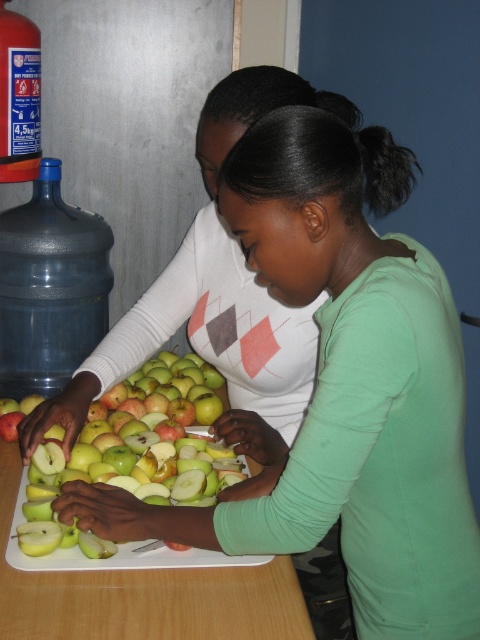
Which is more to the left, green matte apple at center or blue plastic bottle at left?

blue plastic bottle at left

Between point (204, 404) and point (17, 116), which one is positioned in front?

Positioned in front is point (204, 404).

Is point (123, 429) farther from viewer compared to point (31, 32)?

No, (123, 429) is closer to viewer.

At what (x,y) coordinates should I click in order to perform the action: click on green matte apple at center. Please return your answer as a coordinate pair (x, y). Looking at the image, I should click on (145, 456).

The height and width of the screenshot is (640, 480). Describe the element at coordinates (49, 288) in the screenshot. I see `black plastic bottle at left` at that location.

Can you confirm if black plastic bottle at left is smaller than green matte apple at center?

Correct, black plastic bottle at left occupies less space than green matte apple at center.

Between point (54, 214) and point (41, 506), which one is positioned behind?

Positioned behind is point (54, 214).

Find the location of `black plastic bottle at left`. black plastic bottle at left is located at coordinates (49, 288).

Is green plastic tray at center shorter than green matte apple at center?

Correct, green plastic tray at center is not as tall as green matte apple at center.

Describe the element at coordinates (143, 595) in the screenshot. The image size is (480, 640). I see `green plastic tray at center` at that location.

Image resolution: width=480 pixels, height=640 pixels. In order to click on green plastic tray at center in this screenshot , I will do [x=143, y=595].